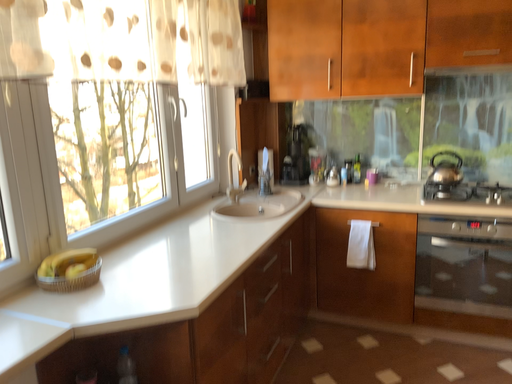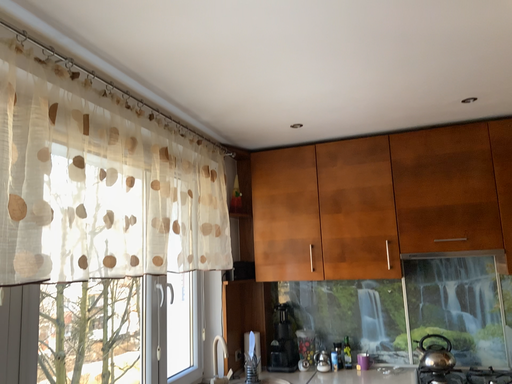
Question: How did the camera likely rotate when shooting the video?

Choices:
 (A) rotated upward
 (B) rotated downward

Answer: (A)